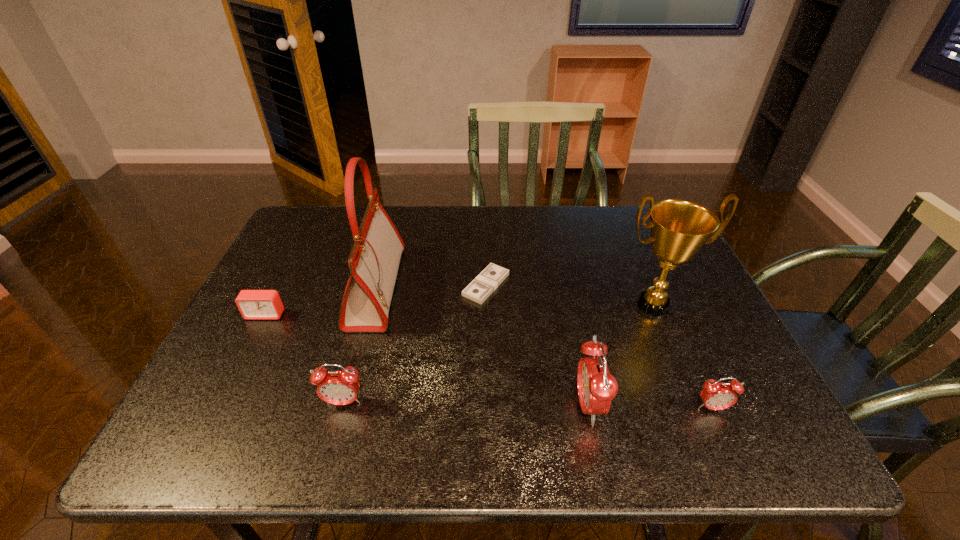
Identify the location of alarm clock at the right edge. (715, 395).

Where is `award present at the right edge`? The image size is (960, 540). award present at the right edge is located at coordinates (679, 228).

This screenshot has width=960, height=540. I want to click on object that is at the near right corner, so click(715, 395).

The image size is (960, 540). In the image, there is a desktop. What are the coordinates of `vacant space at the far edge` in the screenshot? It's located at (606, 231).

This screenshot has width=960, height=540. I want to click on blank space at the near edge, so click(x=653, y=383).

You are a GUI agent. You are given a task and a screenshot of the screen. Output one action in this format:
    pyautogui.click(x=<x>, y=<y>)
    Task: Click on the vacant space at the left edge of the desktop
    
    Given the screenshot: What is the action you would take?
    pyautogui.click(x=263, y=328)

This screenshot has width=960, height=540. I want to click on vacant point at the right edge, so click(671, 349).

Image resolution: width=960 pixels, height=540 pixels. I want to click on vacant region at the far left corner of the desktop, so click(306, 222).

Identify the location of vacant space that's between the shortest object and the fourth shortest object. The height and width of the screenshot is (540, 960). (415, 344).

Identify the location of free point between the second shortest object and the fifth object from left to right. The height and width of the screenshot is (540, 960). (427, 360).